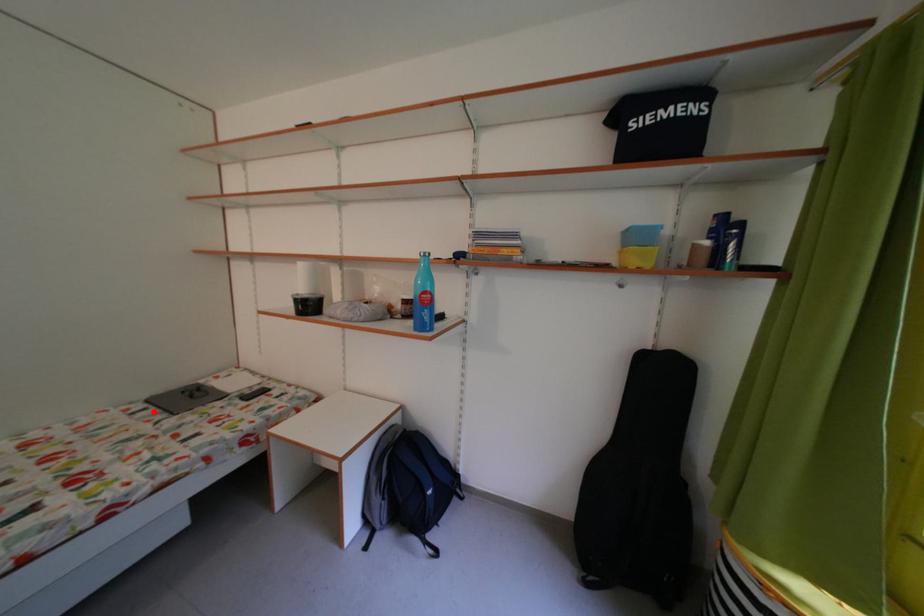
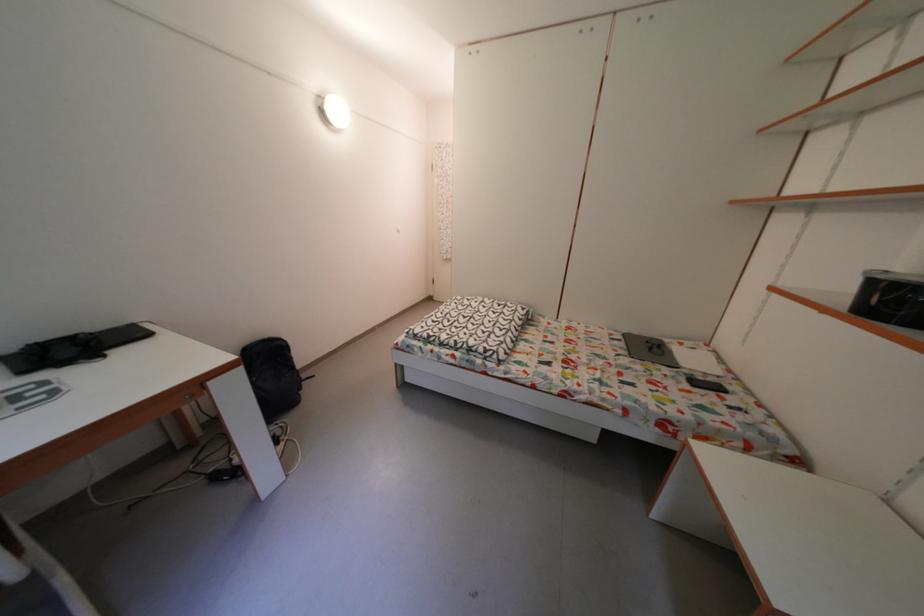
Locate, in the second image, the point that corresponds to the highlighted location in the first image.

(629, 342)